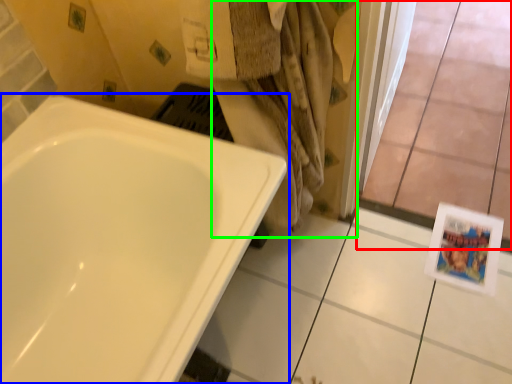
Question: Which is nearer to the glass door (highlighted by a red box)? bathtub (highlighted by a blue box) or bath towel (highlighted by a green box).

Choices:
 (A) bathtub
 (B) bath towel

Answer: (B)